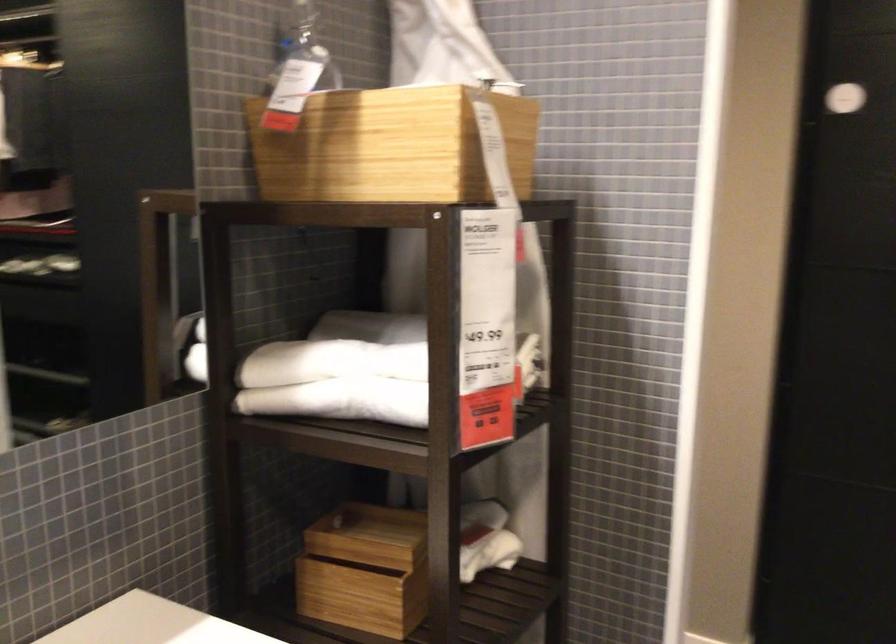
I want to click on wooden box lid, so click(297, 91).